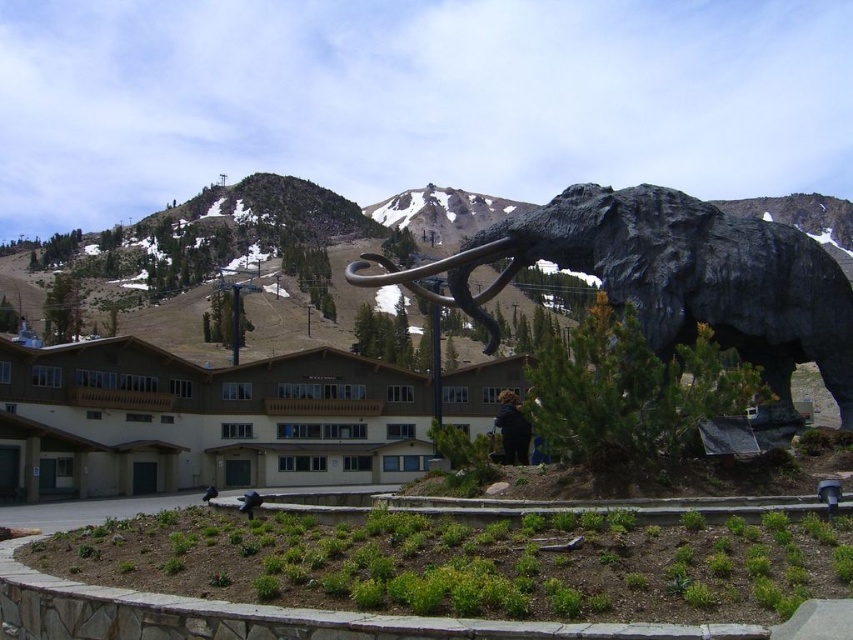
Is brown wood hotel at center bigger than rugged stone mountain at center?

No.

You are a GUI agent. You are given a task and a screenshot of the screen. Output one action in this format:
    pyautogui.click(x=<x>, y=<y>)
    Task: Click on the brown wood hotel at center
    Image resolution: width=853 pixels, height=640 pixels.
    Given the screenshot: What is the action you would take?
    pyautogui.click(x=204, y=419)

Is brown wood hotel at center positioned before black polished stone elephant at center?

No, brown wood hotel at center is behind black polished stone elephant at center.

Between brown wood hotel at center and black polished stone elephant at center, which one is positioned higher?

black polished stone elephant at center is above.

What are the coordinates of `brown wood hotel at center` in the screenshot? It's located at (204, 419).

Between black polished stone elephant at center and rugged stone mountain at center, which one is positioned lower?

black polished stone elephant at center

At what (x,y) coordinates should I click in order to perform the action: click on black polished stone elephant at center. Please return your answer as a coordinate pair (x, y). Looking at the image, I should click on (672, 280).

Is point (616, 259) closer to camera compared to point (404, 214)?

Yes, it is in front of point (404, 214).

Image resolution: width=853 pixels, height=640 pixels. I want to click on black polished stone elephant at center, so click(672, 280).